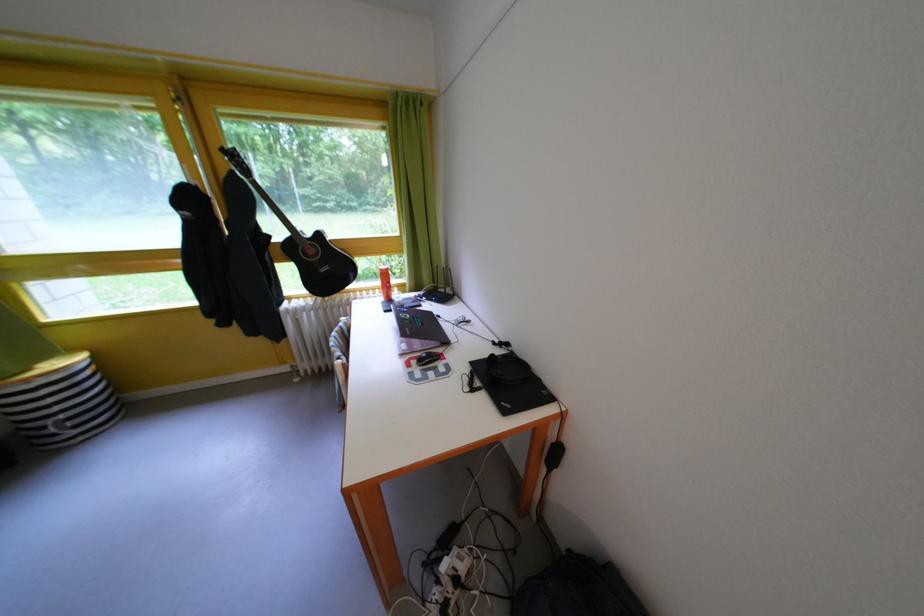
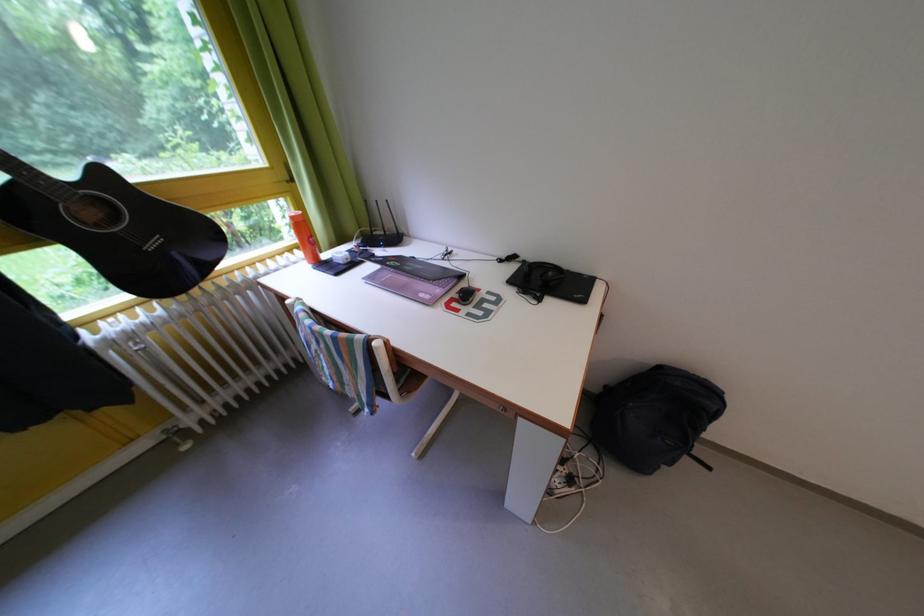
Where in the second image is the point corresponding to [329,241] from the first image?

(112, 179)